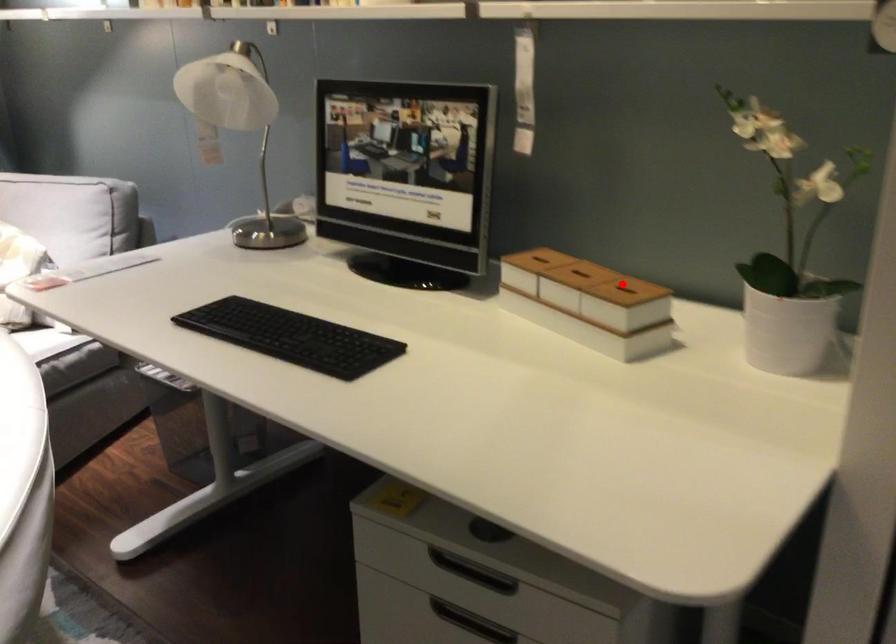
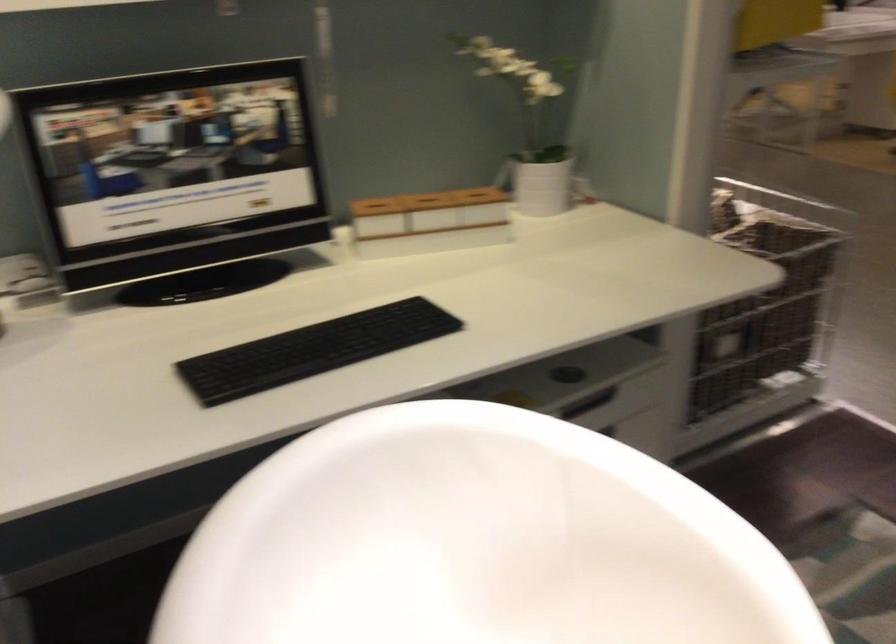
Locate, in the second image, the point that corresponds to the highlighted location in the first image.

(474, 193)